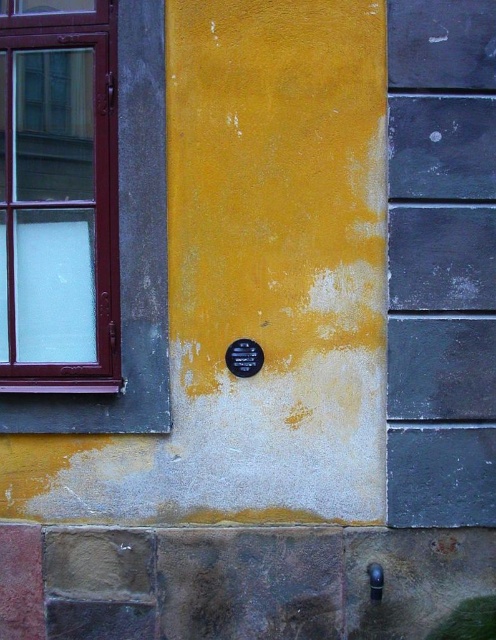
Consider the image. You are an architect evaluating the building facade. You need to determine if the matte glass window at left can accommodate a new decorative element that requires a minimum width of 1.2 meters. Given that the black metal plaque at center is 0.8 meters wide, what is your assessment?

The matte glass window at left has a width larger than the black metal plaque at center, which is 0.8 meters. Since the window is wider, it likely meets the 1.2 meter requirement for the decorative element.

You are standing in front of the building and looking at the exterior wall. There are two points marked on the wall at coordinates point (55, 268) and point (230, 369). Which point is closer to you?

Point (55, 268) is further to the camera than point (230, 369), so the point closer to you is point (230, 369).